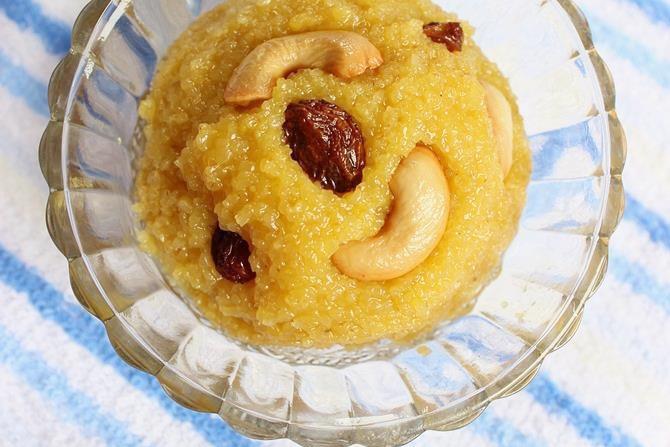
Image resolution: width=670 pixels, height=447 pixels. Find the location of `far left rim of bowl`. far left rim of bowl is located at coordinates (37, 154).